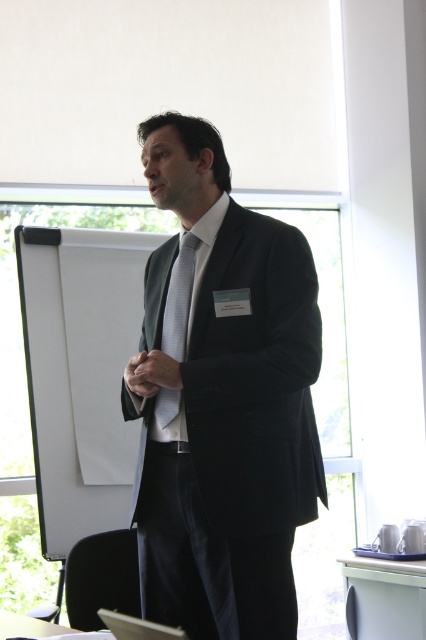
You are standing in the room where the presentation is happening. There are two points marked in the scene. One is at coordinates point [143,582] and the other at point [166,426]. If you were to walk from the speaker towards the flip chart stand, which point would you pass first?

Point [166,426] is in front of point [143,582], so you would pass point [166,426] first when moving from the speaker towards the flip chart stand.

You are an event planner arranging a photo shoot for a professional speaker. You need to ensure that the speaker wearing the matte black suit at center and silky gray tie at center is positioned so that both elements are clearly visible in the frame. Considering their sizes, which item should be placed closer to the camera to avoid being obscured?

The silky gray tie at center should be placed closer to the camera since the matte black suit at center is taller than the silky gray tie at center, making the tie more likely to be obscured if positioned further back.